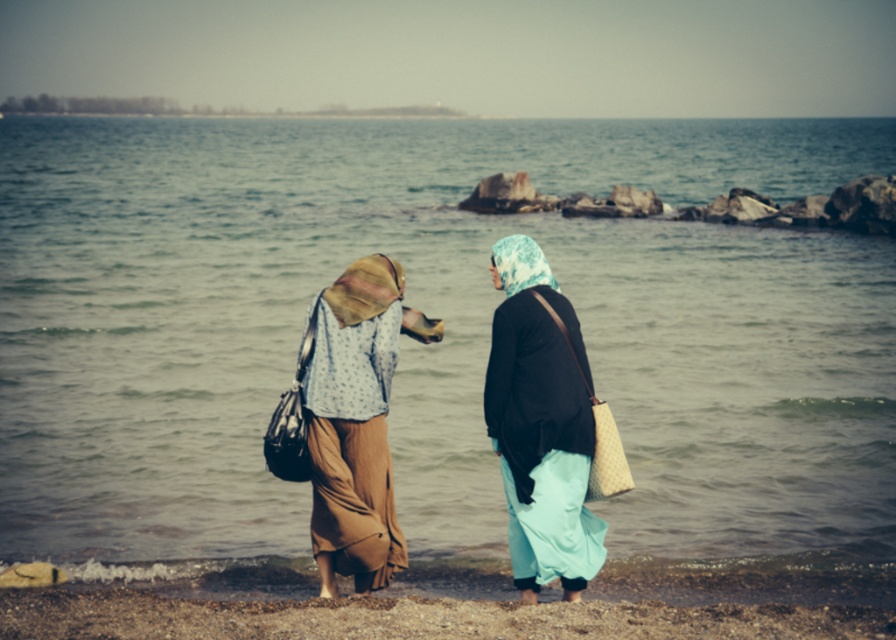
Question: Which object is positioned closest to the light blue printed hijab at center?

Choices:
 (A) greenish-blue water at center
 (B) brown textured skirt at center

Answer: (B)

Question: Does greenish-blue water at center have a lesser width compared to brown textured skirt at center?

Choices:
 (A) yes
 (B) no

Answer: (B)

Question: Which object appears farthest from the camera in this image?

Choices:
 (A) light blue printed hijab at center
 (B) brown textured skirt at center

Answer: (B)

Question: Among these points, which one is farthest from the camera?

Choices:
 (A) (524, 368)
 (B) (372, 320)
 (C) (629, 236)

Answer: (C)

Question: Does greenish-blue water at center have a larger size compared to brown textured skirt at center?

Choices:
 (A) yes
 (B) no

Answer: (A)

Question: Can you confirm if greenish-blue water at center is bigger than light blue printed hijab at center?

Choices:
 (A) no
 (B) yes

Answer: (B)